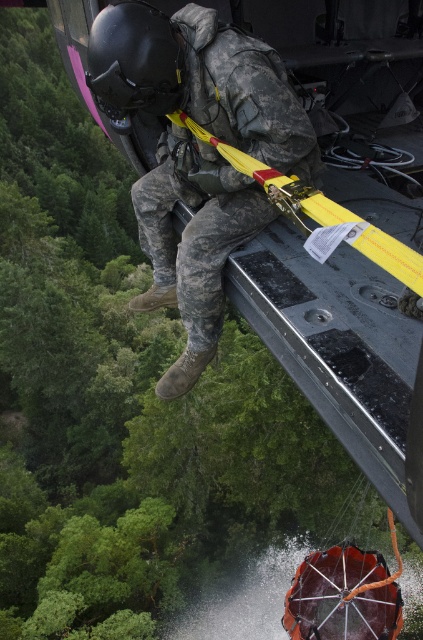
How much distance is there between camouflage fabric soldier at center and black matte helmet at upper left?

camouflage fabric soldier at center is 16.33 centimeters from black matte helmet at upper left.

Measure the distance between camouflage fabric soldier at center and camera.

camouflage fabric soldier at center and camera are 7.14 feet apart.

Locate an element on the screen. The image size is (423, 640). camouflage fabric soldier at center is located at coordinates (200, 80).